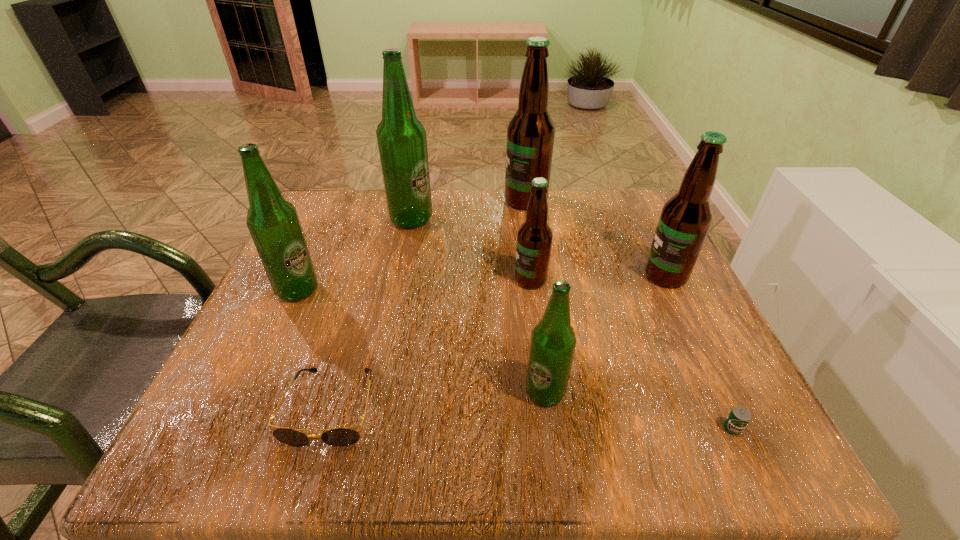
Image resolution: width=960 pixels, height=540 pixels. I want to click on the biggest brown beer bottle, so click(531, 131).

Identify the location of the fifth beer bottle from right to left. The height and width of the screenshot is (540, 960). (402, 143).

This screenshot has height=540, width=960. In order to click on the farthest green beer bottle in this screenshot , I will do 402,143.

Where is `the second biggest brown beer bottle`? the second biggest brown beer bottle is located at coordinates (685, 219).

Locate an element on the screen. This screenshot has width=960, height=540. the rightmost brown beer bottle is located at coordinates (685, 219).

Find the location of a particular element. Image resolution: width=960 pixels, height=540 pixels. the leftmost object is located at coordinates (274, 225).

Where is `the leftmost beer bottle`? The width and height of the screenshot is (960, 540). the leftmost beer bottle is located at coordinates (274, 225).

Identify the location of the smallest brown beer bottle. pos(534,238).

The image size is (960, 540). I want to click on the nearest beer bottle, so click(553, 341).

Where is `the rightmost green beer bottle`? the rightmost green beer bottle is located at coordinates (553, 341).